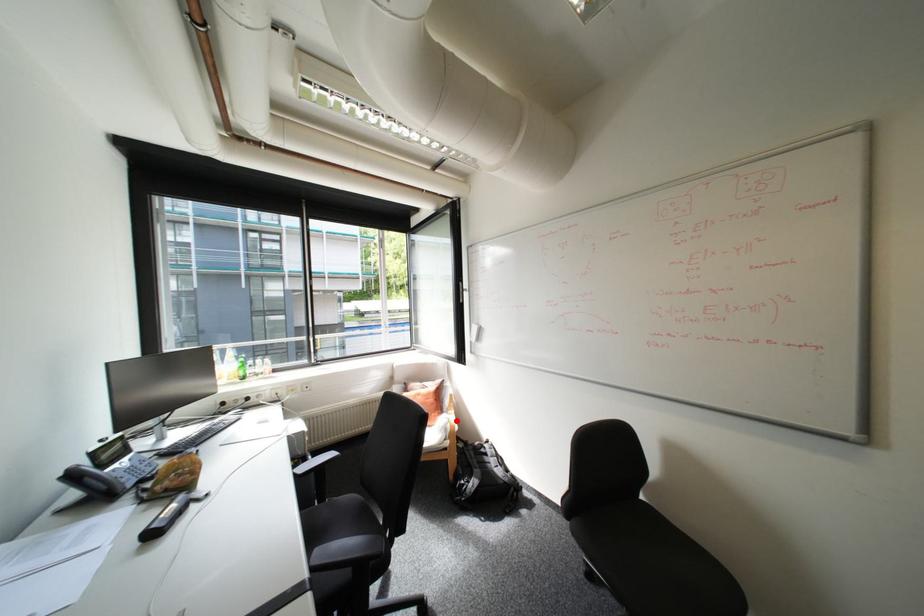
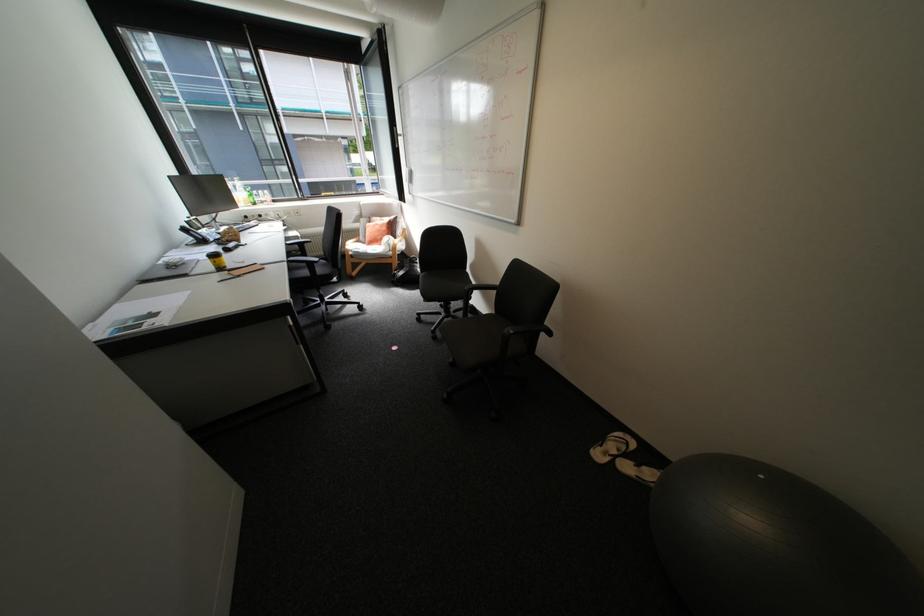
Find the pixel in the second image that matches the highlighted location in the first image.

(397, 238)